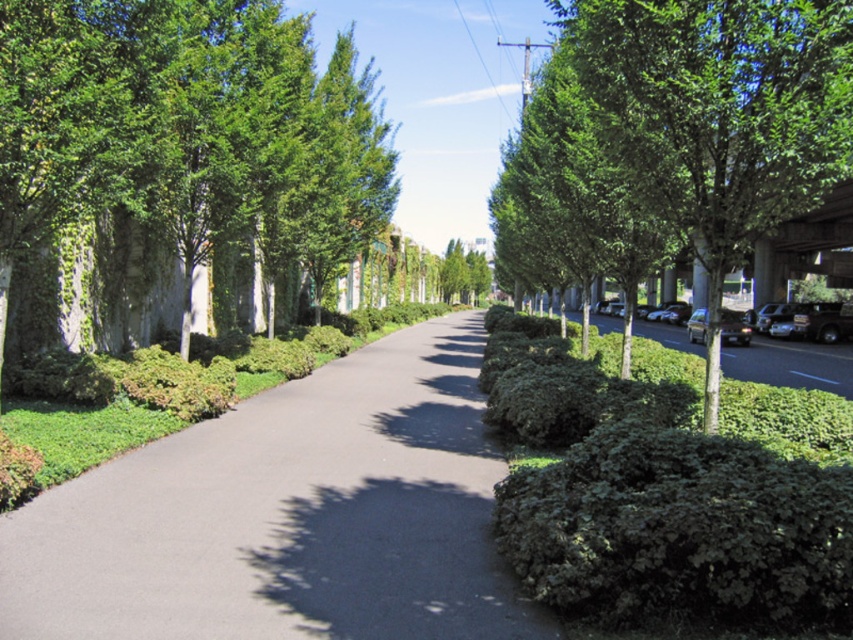
Question: Is green leafy tree at left above shiny black sedan at right?

Choices:
 (A) yes
 (B) no

Answer: (A)

Question: Can you confirm if black asphalt road at center is positioned to the right of green leafy tree at left?

Choices:
 (A) no
 (B) yes

Answer: (B)

Question: Which object is the farthest from the green leafy hedge at right?

Choices:
 (A) green leafy tree at left
 (B) green leafy tree at right
 (C) black asphalt road at center

Answer: (A)

Question: Estimate the real-world distances between objects in this image. Which object is farther from the metallic silver car at right?

Choices:
 (A) black asphalt road at center
 (B) shiny black sedan at right
 (C) green leafy tree at left

Answer: (A)

Question: From the image, what is the correct spatial relationship of black asphalt road at center in relation to green leafy tree at right?

Choices:
 (A) above
 (B) below

Answer: (B)

Question: Based on their relative distances, which object is nearer to the metallic silver car at right?

Choices:
 (A) green leafy tree at left
 (B) black asphalt road at center
 (C) shiny black sedan at right
 (D) green leafy hedge at right

Answer: (C)